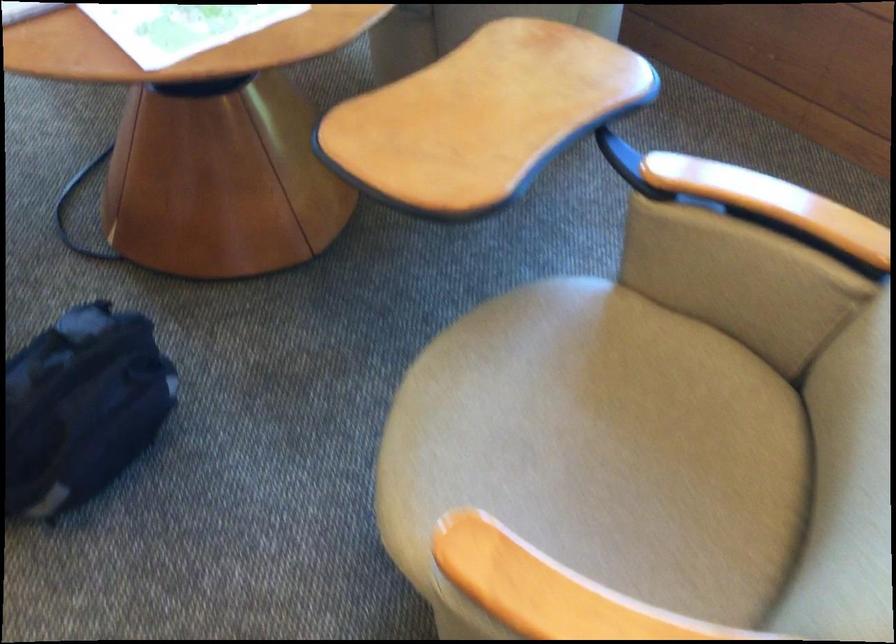
This screenshot has width=896, height=644. Identify the location of pivoting wooden tray. (483, 116).